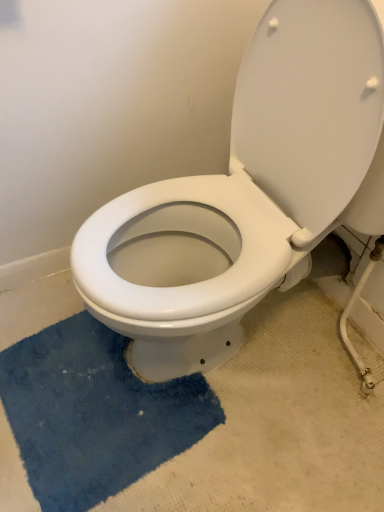
Question: From the image's perspective, is white glossy toilet at center above or below blue plush bath mat at lower left?

Choices:
 (A) below
 (B) above

Answer: (B)

Question: Does point (243, 87) appear closer or farther from the camera than point (77, 476)?

Choices:
 (A) closer
 (B) farther

Answer: (A)

Question: Considering the positions of white glossy toilet at center and blue plush bath mat at lower left in the image, is white glossy toilet at center bigger or smaller than blue plush bath mat at lower left?

Choices:
 (A) small
 (B) big

Answer: (B)

Question: In the image, is blue plush bath mat at lower left on the left side or the right side of white glossy toilet at center?

Choices:
 (A) right
 (B) left

Answer: (B)

Question: From a real-world perspective, is blue plush bath mat at lower left positioned above or below white glossy toilet at center?

Choices:
 (A) below
 (B) above

Answer: (A)

Question: Is blue plush bath mat at lower left taller or shorter than white glossy toilet at center?

Choices:
 (A) short
 (B) tall

Answer: (A)

Question: Is point (188, 387) closer or farther from the camera than point (233, 168)?

Choices:
 (A) closer
 (B) farther

Answer: (B)